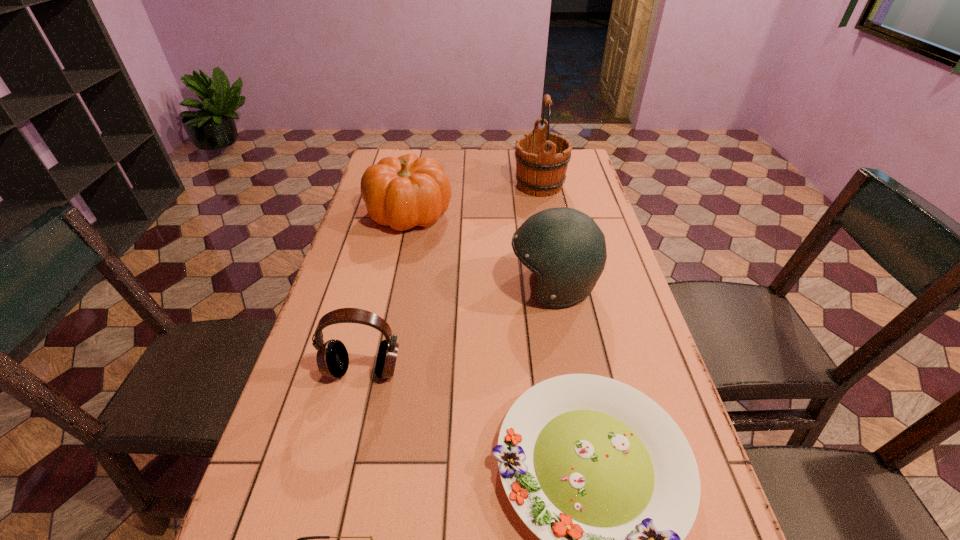
This screenshot has width=960, height=540. Identify the location of empty location between the headset and the pumpkin. (386, 292).

The image size is (960, 540). Find the location of `free spot between the pumpkin and the tallest object`. free spot between the pumpkin and the tallest object is located at coordinates (474, 199).

What are the coordinates of `vacant area between the headset and the pumpkin` in the screenshot? It's located at (386, 292).

At what (x,y) coordinates should I click in order to perform the action: click on object that is the fourth closest one to the salad plate. Please return your answer as a coordinate pair (x, y). The image size is (960, 540). Looking at the image, I should click on (408, 191).

Select which object appears as the fourth closest to the sunglasses. Please provide its 2D coordinates. Your answer should be formatted as a tuple, i.e. [(x, y)], where the tuple contains the x and y coordinates of a point satisfying the conditions above.

[(408, 191)]

At what (x,y) coordinates should I click in order to perform the action: click on free spot that satisfies the following two spatial constraints: 1. at the face opening of the third farthest object; 2. on the ear pads of the headset. Please return your answer as a coordinate pair (x, y). Looking at the image, I should click on (568, 370).